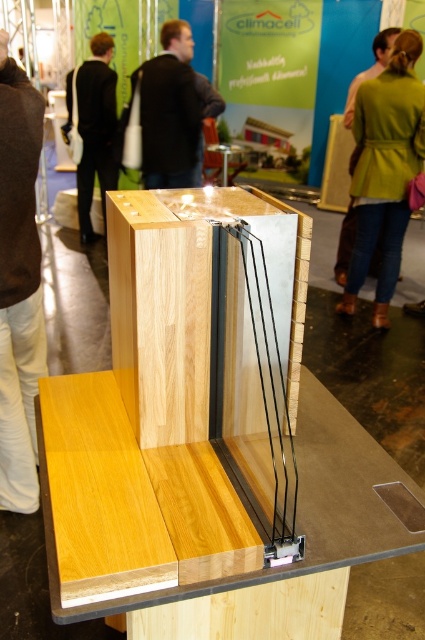
You are an architect designing a new exhibition stand and need to place a 12 cm wide decorative item between the light wood table at center and the light brown wood at center. Based on the model displayed, will the item fit in the space between them?

The space between the light wood table at center and the light brown wood at center is only 11.23 centimeters. Since the decorative item is 12 cm wide, it will not fit in the available space.

You are an architect examining the model wall section at the exhibition. You notice two wooden elements labeled as the light wood table at center and the light brown wood at center. Which of these two wooden elements is located to the left of the other?

The light wood table at center is positioned on the right side of light brown wood at center, so the light brown wood at center is to the left of the light wood table at center.